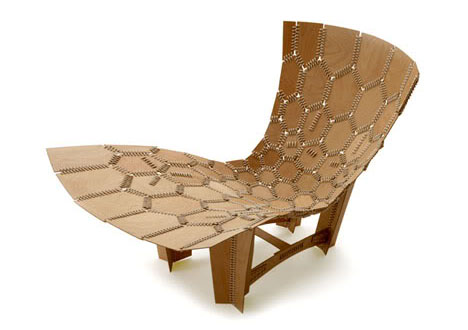
The image size is (468, 330). Identify the location of lounger chair. (278, 191).